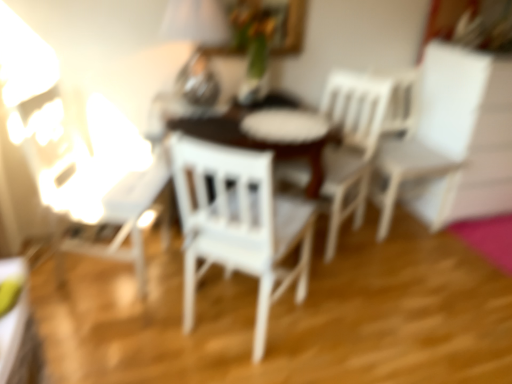
What is the approximate width of white matte chair at right, which is counted as the first chair, starting from the right?

white matte chair at right, which is counted as the first chair, starting from the right, is 22.78 inches in width.

Describe the element at coordinates (196, 22) in the screenshot. I see `metallic silver table lamp at upper center` at that location.

Locate an element on the screen. The height and width of the screenshot is (384, 512). white wood chair at center, the 3th chair when ordered from right to left is located at coordinates (238, 224).

Between white wood chair at center, the 3th chair when ordered from right to left, and white matte chair at right, which is counted as the first chair, starting from the right, which one appears on the left side from the viewer's perspective?

Positioned to the left is white wood chair at center, the 3th chair when ordered from right to left.

Which is in front, point (225, 157) or point (439, 227)?

Point (225, 157)

Based on the photo, would you consider white wood chair at center, which appears as the 1th chair when viewed from the left, to be distant from white matte chair at right, which appears as the third chair when viewed from the left?

Yes, white wood chair at center, which appears as the 1th chair when viewed from the left, is far from white matte chair at right, which appears as the third chair when viewed from the left.

Is point (197, 28) farther from viewer compared to point (451, 159)?

No, (197, 28) is closer to viewer.

Is metallic silver table lamp at upper center oriented towards white matte chair at right, which appears as the third chair when viewed from the left?

No, metallic silver table lamp at upper center does not turn towards white matte chair at right, which appears as the third chair when viewed from the left.

In the image, there is a white matte chair at right, which appears as the third chair when viewed from the left. Find the location of `table lamp above it (from the image's perspective)`. table lamp above it (from the image's perspective) is located at coordinates (196, 22).

Is metallic silver table lamp at upper center surrounding white matte chair at right, which appears as the third chair when viewed from the left?

Actually, white matte chair at right, which appears as the third chair when viewed from the left, is outside metallic silver table lamp at upper center.

Is point (237, 155) positioned after point (182, 87)?

No, it is not.

Relative to metallic silver table lamp at upper center, is white wood chair at center, the 3th chair when ordered from right to left, in front or behind?

In the image, white wood chair at center, the 3th chair when ordered from right to left, appears in front of metallic silver table lamp at upper center.

From the image's perspective, is white wood chair at center, which appears as the 1th chair when viewed from the left, over metallic silver table lamp at upper center?

Actually, white wood chair at center, which appears as the 1th chair when viewed from the left, appears below metallic silver table lamp at upper center in the image.

Is white wood chair at center, which appears as the 1th chair when viewed from the left, aimed at metallic silver table lamp at upper center?

No, white wood chair at center, which appears as the 1th chair when viewed from the left, is not oriented towards metallic silver table lamp at upper center.

Is metallic silver table lamp at upper center inside the boundaries of white wood chair at center, which appears as the 1th chair when viewed from the left, or outside?

The correct answer is: outside.

This screenshot has height=384, width=512. There is a white wood chair at center, the 3th chair when ordered from right to left. In order to click on table lamp above it (from a real-world perspective) in this screenshot , I will do `click(196, 22)`.

Is metallic silver table lamp at upper center thinner than white wood chair at center, which appears as the 1th chair when viewed from the left?

Correct, the width of metallic silver table lamp at upper center is less than that of white wood chair at center, which appears as the 1th chair when viewed from the left.

Which is more to the left, metallic silver table lamp at upper center or white wood chair at center, the 3th chair when ordered from right to left?

Positioned to the left is metallic silver table lamp at upper center.

From the image's perspective, is white matte chair at right, which is counted as the first chair, starting from the right, located above white wood chair at center, which appears as the 1th chair when viewed from the left?

Yes.

Is white matte chair at right, which appears as the third chair when viewed from the left, positioned far away from white wood chair at center, which appears as the 1th chair when viewed from the left?

Yes, white matte chair at right, which appears as the third chair when viewed from the left, and white wood chair at center, which appears as the 1th chair when viewed from the left, are quite far apart.

Image resolution: width=512 pixels, height=384 pixels. Identify the location of chair that is the 2nd one when counting backward from the white wood chair at center, which appears as the 1th chair when viewed from the left. (434, 136).

Based on the photo, from a real-world perspective, is white matte chair at right, which appears as the third chair when viewed from the left, under white wood chair at center, which appears as the 1th chair when viewed from the left?

Incorrect, from a real-world perspective, white matte chair at right, which appears as the third chair when viewed from the left, is higher than white wood chair at center, which appears as the 1th chair when viewed from the left.

Considering the sizes of white wood chair at center, the 3th chair when ordered from right to left, and white wood chair at center, positioned as the second chair in right-to-left order, in the image, is white wood chair at center, the 3th chair when ordered from right to left, taller or shorter than white wood chair at center, positioned as the second chair in right-to-left order,?

Clearly, white wood chair at center, the 3th chair when ordered from right to left, is taller compared to white wood chair at center, positioned as the second chair in right-to-left order.

Where is `chair lying below the white wood chair at center, the 2th chair when ordered from left to right (from the image's perspective)`? Image resolution: width=512 pixels, height=384 pixels. chair lying below the white wood chair at center, the 2th chair when ordered from left to right (from the image's perspective) is located at coordinates (238, 224).

Does white wood chair at center, the 3th chair when ordered from right to left, have a smaller size compared to white wood chair at center, the 2th chair when ordered from left to right?

No, white wood chair at center, the 3th chair when ordered from right to left, is not smaller than white wood chair at center, the 2th chair when ordered from left to right.

Is white wood chair at center, the 3th chair when ordered from right to left, positioned with its back to white wood chair at center, the 2th chair when ordered from left to right?

white wood chair at center, the 3th chair when ordered from right to left, does not have its back to white wood chair at center, the 2th chair when ordered from left to right.

Is point (450, 79) positioned before point (348, 210)?

Yes, it is in front of point (348, 210).

From a real-world perspective, is white matte chair at right, which is counted as the first chair, starting from the right, positioned above or below white wood chair at center, the 2th chair when ordered from left to right?

In terms of real-world spatial position, white matte chair at right, which is counted as the first chair, starting from the right, is above white wood chair at center, the 2th chair when ordered from left to right.

Is white matte chair at right, which is counted as the first chair, starting from the right, facing towards white wood chair at center, the 2th chair when ordered from left to right?

No.

Considering the relative sizes of white matte chair at right, which is counted as the first chair, starting from the right, and white wood chair at center, positioned as the second chair in right-to-left order, in the image provided, is white matte chair at right, which is counted as the first chair, starting from the right, bigger than white wood chair at center, positioned as the second chair in right-to-left order,?

Correct, white matte chair at right, which is counted as the first chair, starting from the right, is larger in size than white wood chair at center, positioned as the second chair in right-to-left order.

From the image's perspective, count 2nd chairs upward from the white wood chair at center, which appears as the 1th chair when viewed from the left, and point to it. Please provide its 2D coordinates.

[(434, 136)]

Identify the location of table lamp above the white matte chair at right, which is counted as the first chair, starting from the right (from a real-world perspective). The image size is (512, 384). tap(196, 22).

Looking at the image, which one is located further to metallic silver table lamp at upper center, white wood chair at center, positioned as the second chair in right-to-left order, or white matte chair at right, which appears as the third chair when viewed from the left?

white matte chair at right, which appears as the third chair when viewed from the left, is further to metallic silver table lamp at upper center.

Estimate the real-world distances between objects in this image. Which object is closer to white wood chair at center, positioned as the second chair in right-to-left order, metallic silver table lamp at upper center or white matte chair at right, which appears as the third chair when viewed from the left?

white matte chair at right, which appears as the third chair when viewed from the left, lies closer to white wood chair at center, positioned as the second chair in right-to-left order, than the other object.

Considering their positions, is white matte chair at right, which is counted as the first chair, starting from the right, positioned further to metallic silver table lamp at upper center than white wood chair at center, the 3th chair when ordered from right to left?

white matte chair at right, which is counted as the first chair, starting from the right, is positioned further to the anchor metallic silver table lamp at upper center.

From the image, which object appears to be farther from white wood chair at center, positioned as the second chair in right-to-left order, metallic silver table lamp at upper center or white wood chair at center, which appears as the 1th chair when viewed from the left?

metallic silver table lamp at upper center.

Considering their positions, is metallic silver table lamp at upper center positioned further to white wood chair at center, which appears as the 1th chair when viewed from the left, than white wood chair at center, positioned as the second chair in right-to-left order?

metallic silver table lamp at upper center lies further to white wood chair at center, which appears as the 1th chair when viewed from the left, than the other object.

Based on their spatial positions, is white wood chair at center, which appears as the 1th chair when viewed from the left, or white wood chair at center, the 2th chair when ordered from left to right, closer to white matte chair at right, which is counted as the first chair, starting from the right?

white wood chair at center, the 2th chair when ordered from left to right.

Based on the photo, considering their positions, is white wood chair at center, the 3th chair when ordered from right to left, positioned closer to white wood chair at center, positioned as the second chair in right-to-left order, than white matte chair at right, which is counted as the first chair, starting from the right?

The object closer to white wood chair at center, positioned as the second chair in right-to-left order, is white matte chair at right, which is counted as the first chair, starting from the right.

Considering their positions, is white matte chair at right, which appears as the third chair when viewed from the left, positioned further to white wood chair at center, the 2th chair when ordered from left to right, than white wood chair at center, which appears as the 1th chair when viewed from the left?

Among the two, white wood chair at center, which appears as the 1th chair when viewed from the left, is located further to white wood chair at center, the 2th chair when ordered from left to right.

Where is `chair situated between white wood chair at center, the 3th chair when ordered from right to left, and white matte chair at right, which appears as the third chair when viewed from the left, from left to right`? The height and width of the screenshot is (384, 512). chair situated between white wood chair at center, the 3th chair when ordered from right to left, and white matte chair at right, which appears as the third chair when viewed from the left, from left to right is located at coordinates (351, 144).